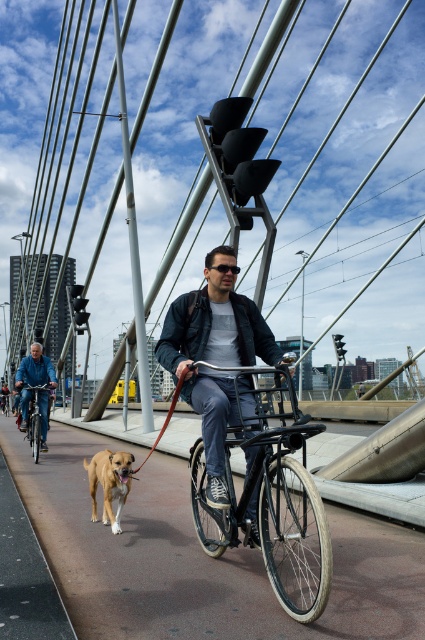
Is point (405, 580) behind point (101, 465)?

No, (405, 580) is in front of (101, 465).

What do you see at coordinates (198, 557) in the screenshot? I see `smooth asphalt bike lane at center` at bounding box center [198, 557].

Who is more forward, (x=374, y=612) or (x=115, y=470)?

Point (x=374, y=612) is more forward.

This screenshot has height=640, width=425. I want to click on smooth asphalt bike lane at center, so click(198, 557).

Which is below, matte black jacket at center or brown leather leash at center?

brown leather leash at center is below.

At what (x,y) coordinates should I click in order to perform the action: click on matte black jacket at center. Please return your answer as a coordinate pair (x, y). The height and width of the screenshot is (640, 425). Looking at the image, I should click on (215, 323).

Which is behind, point (82, 552) or point (292, 531)?

Point (292, 531)

Which is below, smooth asphalt bike lane at center or black matte bicycle at center?

Positioned lower is smooth asphalt bike lane at center.

Is point (110, 541) closer to camera compared to point (283, 518)?

Yes, point (110, 541) is closer to viewer.

At what (x,y) coordinates should I click in order to perform the action: click on smooth asphalt bike lane at center. Please return your answer as a coordinate pair (x, y). This screenshot has width=425, height=640. Looking at the image, I should click on (198, 557).